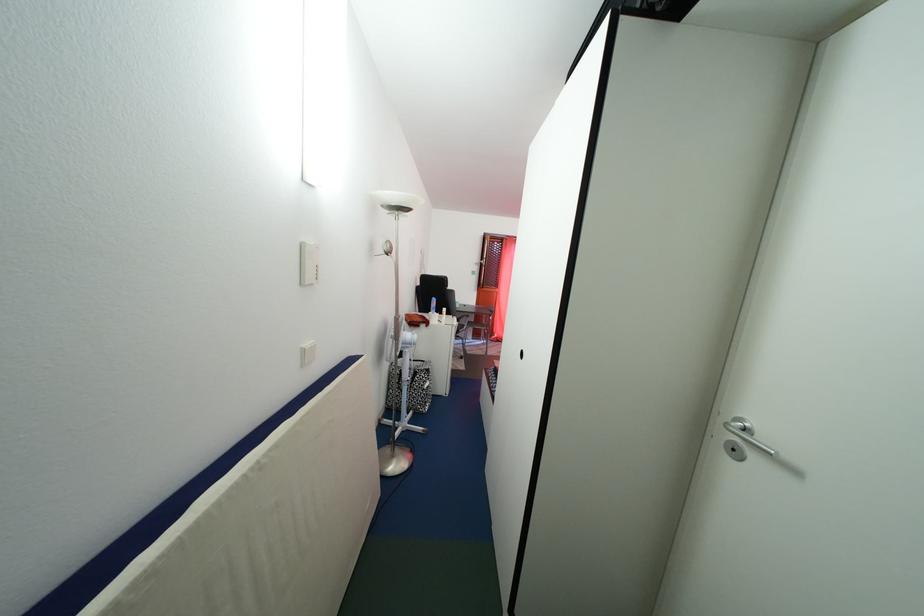
Where is `door keyhole`? door keyhole is located at coordinates (735, 450).